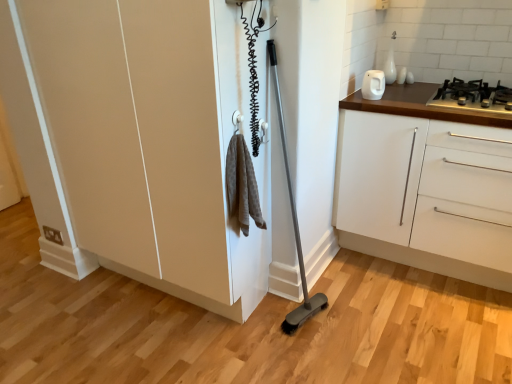
Find the location of a particular element. The height and width of the screenshot is (384, 512). white glossy cabinet at right is located at coordinates (426, 194).

I want to click on black metal gas stove at upper right, so click(473, 96).

Who is shorter, matte beige cupboard at center or black metal gas stove at upper right?

black metal gas stove at upper right is shorter.

How much distance is there between matte beige cupboard at center and black metal gas stove at upper right?

matte beige cupboard at center and black metal gas stove at upper right are 3.92 feet apart from each other.

Is matte beige cupboard at center outside of black metal gas stove at upper right?

Yes, matte beige cupboard at center is not within black metal gas stove at upper right.

You are a GUI agent. You are given a task and a screenshot of the screen. Output one action in this format:
    pyautogui.click(x=<x>, y=<y>)
    Task: Click on the cupboard lying on the left of black metal gas stove at upper right
    This screenshot has height=384, width=512.
    Given the screenshot: What is the action you would take?
    pyautogui.click(x=180, y=139)

Looking at this image, from a real-world perspective, is matte beige cupboard at center above or below white glossy cabinet at right?

matte beige cupboard at center is situated higher than white glossy cabinet at right in the real world.

This screenshot has height=384, width=512. I want to click on cupboard that appears in front of the white glossy cabinet at right, so click(180, 139).

Is matte beige cupboard at center bigger or smaller than white glossy cabinet at right?

Clearly, matte beige cupboard at center is larger in size than white glossy cabinet at right.

Does matte beige cupboard at center come in front of white glossy cabinet at right?

Yes, matte beige cupboard at center is closer to the camera.

Is black metal gas stove at upper right located outside white glossy kettle at upper right?

Yes, black metal gas stove at upper right is not within white glossy kettle at upper right.

Is black metal gas stove at upper right further to the viewer compared to white glossy kettle at upper right?

No.

Considering the positions of point (455, 77) and point (372, 98), is point (455, 77) closer or farther from the camera than point (372, 98)?

Point (455, 77).

Is black metal gas stove at upper right smaller than white glossy kettle at upper right?

Answer: No, black metal gas stove at upper right is not smaller than white glossy kettle at upper right.

Does matte beige cupboard at center have a lesser height compared to white glossy kettle at upper right?

No.

Where is `home appliance on the right side of matte beige cupboard at center`? home appliance on the right side of matte beige cupboard at center is located at coordinates (373, 85).

In the scene shown: Based on their sizes in the image, would you say matte beige cupboard at center is bigger or smaller than white glossy kettle at upper right?

matte beige cupboard at center is bigger than white glossy kettle at upper right.

From the picture: Which object is wider, black metal gas stove at upper right or white glossy cabinet at right?

white glossy cabinet at right.

Is black metal gas stove at upper right far away from white glossy cabinet at right?

No, black metal gas stove at upper right is in close proximity to white glossy cabinet at right.

Considering the relative sizes of black metal gas stove at upper right and white glossy cabinet at right in the image provided, is black metal gas stove at upper right smaller than white glossy cabinet at right?

Yes, black metal gas stove at upper right is smaller than white glossy cabinet at right.

Identify the location of gas stove lying behind the white glossy cabinet at right. (473, 96).

From a real-world perspective, is white glossy kettle at upper right beneath matte beige cupboard at center?

No, from a real-world perspective, white glossy kettle at upper right is not beneath matte beige cupboard at center.

How much distance is there between white glossy kettle at upper right and matte beige cupboard at center?

white glossy kettle at upper right is 3.37 feet away from matte beige cupboard at center.

Is point (365, 85) closer to viewer compared to point (174, 227)?

No, (365, 85) is behind (174, 227).

What's the angular difference between white glossy kettle at upper right and matte beige cupboard at center's facing directions?

white glossy kettle at upper right and matte beige cupboard at center are facing 3.71 degrees away from each other.

Considering the positions of points (368, 88) and (474, 195), is point (368, 88) closer to camera compared to point (474, 195)?

No, it is not.

How distant is white glossy kettle at upper right from white glossy cabinet at right?

The distance of white glossy kettle at upper right from white glossy cabinet at right is 20.34 inches.

Is white glossy kettle at upper right in front of white glossy cabinet at right?

No, it is behind white glossy cabinet at right.

Is white glossy kettle at upper right not inside white glossy cabinet at right?

Absolutely, white glossy kettle at upper right is external to white glossy cabinet at right.

Identify the location of gas stove that appears behind the matte beige cupboard at center. This screenshot has height=384, width=512. (473, 96).

The image size is (512, 384). In the image, there is a matte beige cupboard at center. Identify the location of cabinetry below it (from a real-world perspective). (426, 194).

When comparing their distances from white glossy kettle at upper right, does white glossy cabinet at right or black metal gas stove at upper right seem closer?

black metal gas stove at upper right.

Estimate the real-world distances between objects in this image. Which object is closer to matte beige cupboard at center, black metal gas stove at upper right or white glossy kettle at upper right?

white glossy kettle at upper right.

From the image, which object appears to be nearer to white glossy cabinet at right, black metal gas stove at upper right or white glossy kettle at upper right?

black metal gas stove at upper right.

Which object lies further to the anchor point black metal gas stove at upper right, matte beige cupboard at center or white glossy cabinet at right?

matte beige cupboard at center lies further to black metal gas stove at upper right than the other object.

Based on their spatial positions, is white glossy cabinet at right or black metal gas stove at upper right further from matte beige cupboard at center?

black metal gas stove at upper right is further to matte beige cupboard at center.

Which object lies nearer to the anchor point white glossy cabinet at right, matte beige cupboard at center or black metal gas stove at upper right?

The object closer to white glossy cabinet at right is black metal gas stove at upper right.

Looking at the image, which one is located closer to white glossy kettle at upper right, black metal gas stove at upper right or matte beige cupboard at center?

Among the two, black metal gas stove at upper right is located nearer to white glossy kettle at upper right.

Estimate the real-world distances between objects in this image. Which object is further from matte beige cupboard at center, white glossy kettle at upper right or white glossy cabinet at right?

white glossy kettle at upper right.

At what (x,y) coordinates should I click in order to perform the action: click on home appliance located between matte beige cupboard at center and white glossy cabinet at right in the left-right direction. Please return your answer as a coordinate pair (x, y). The height and width of the screenshot is (384, 512). Looking at the image, I should click on (373, 85).

This screenshot has height=384, width=512. I want to click on cabinetry between matte beige cupboard at center and black metal gas stove at upper right, so click(426, 194).

This screenshot has height=384, width=512. I want to click on home appliance located between matte beige cupboard at center and black metal gas stove at upper right in the left-right direction, so click(373, 85).

At what (x,y) coordinates should I click in order to perform the action: click on gas stove between white glossy kettle at upper right and white glossy cabinet at right vertically. Please return your answer as a coordinate pair (x, y). The height and width of the screenshot is (384, 512). Looking at the image, I should click on point(473,96).